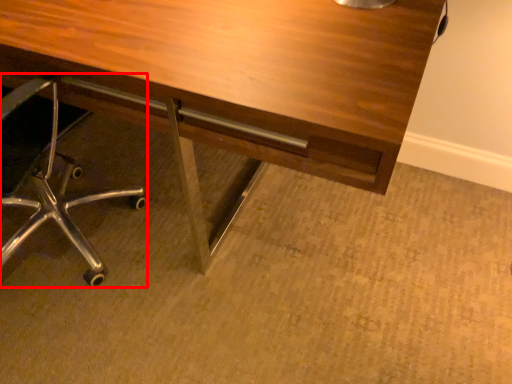
Question: From the image's perspective, where is chair (annotated by the red box) located relative to desk?

Choices:
 (A) below
 (B) above

Answer: (A)